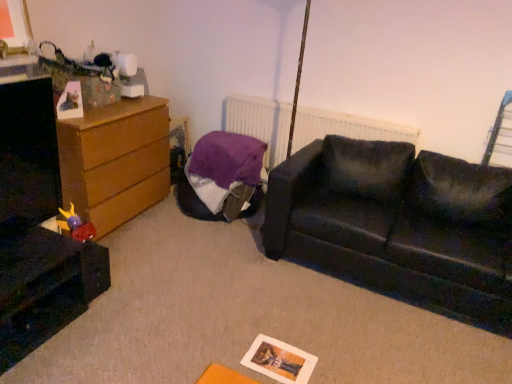
Question: Should I look upward or downward to see metallic silver swivel chair at upper right?

Choices:
 (A) down
 (B) up

Answer: (B)

Question: Is plush purple toy at lower left located within black glossy file cabinet at lower left?

Choices:
 (A) no
 (B) yes

Answer: (A)

Question: Is black glossy file cabinet at lower left positioned in front of plush purple toy at lower left?

Choices:
 (A) yes
 (B) no

Answer: (A)

Question: Is black glossy file cabinet at lower left turned away from plush purple toy at lower left?

Choices:
 (A) yes
 (B) no

Answer: (B)

Question: Does black glossy file cabinet at lower left have a greater width compared to plush purple toy at lower left?

Choices:
 (A) no
 (B) yes

Answer: (B)

Question: From the image's perspective, is black glossy file cabinet at lower left below plush purple toy at lower left?

Choices:
 (A) yes
 (B) no

Answer: (A)

Question: Could you tell me if black glossy file cabinet at lower left is facing plush purple toy at lower left?

Choices:
 (A) yes
 (B) no

Answer: (B)

Question: From a real-world perspective, does metallic silver swivel chair at upper right sit lower than black glossy file cabinet at lower left?

Choices:
 (A) yes
 (B) no

Answer: (B)

Question: Is metallic silver swivel chair at upper right closer to camera compared to black glossy file cabinet at lower left?

Choices:
 (A) yes
 (B) no

Answer: (B)

Question: Would you say metallic silver swivel chair at upper right contains black glossy file cabinet at lower left?

Choices:
 (A) yes
 (B) no

Answer: (B)

Question: Is metallic silver swivel chair at upper right next to black glossy file cabinet at lower left and touching it?

Choices:
 (A) no
 (B) yes

Answer: (A)

Question: Is metallic silver swivel chair at upper right shorter than black glossy file cabinet at lower left?

Choices:
 (A) no
 (B) yes

Answer: (A)

Question: Is metallic silver swivel chair at upper right positioned behind black glossy file cabinet at lower left?

Choices:
 (A) no
 (B) yes

Answer: (B)

Question: Is wooden chest of drawers at left bigger than purple fabric bean bag at center?

Choices:
 (A) no
 (B) yes

Answer: (B)